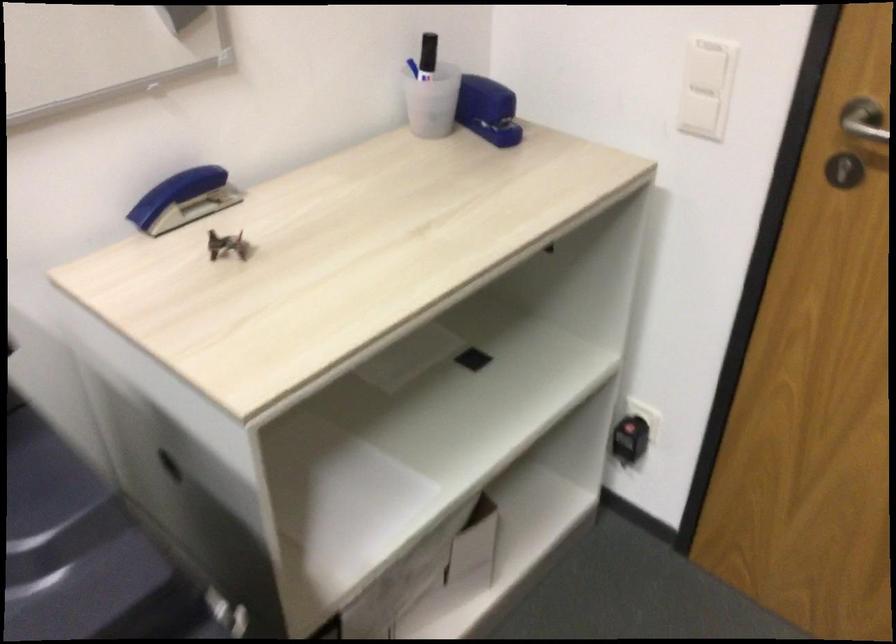
The location [412,67] corresponds to which object?

This point indicates the blue pen.